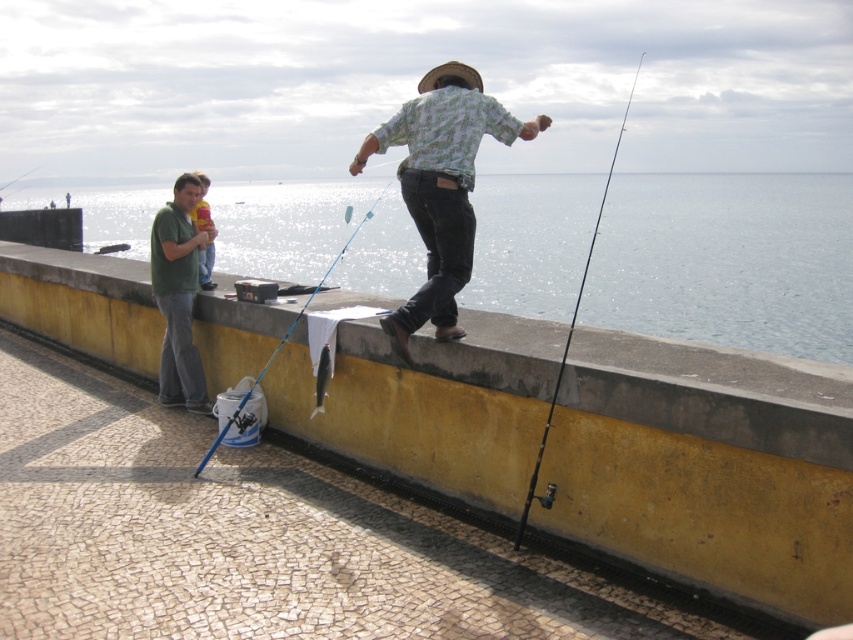
Does green cotton shirt at left have a larger size compared to blue metallic fishing pole at center?

Actually, green cotton shirt at left might be smaller than blue metallic fishing pole at center.

Does green cotton shirt at left appear over blue metallic fishing pole at center?

Actually, green cotton shirt at left is below blue metallic fishing pole at center.

Find the location of a particular element. The width and height of the screenshot is (853, 640). green cotton shirt at left is located at coordinates (178, 296).

Between point (173, 396) and point (537, 474), which one is positioned in front?

Point (537, 474) is in front.

How far apart are green cotton shirt at left and black matte fishing pole at center?

green cotton shirt at left and black matte fishing pole at center are 13.38 meters apart from each other.

Find the location of a particular element. The height and width of the screenshot is (640, 853). green cotton shirt at left is located at coordinates (178, 296).

Can you confirm if floral shirt at center is shorter than shiny silver fish at center?

No.

Is floral shirt at center smaller than shiny silver fish at center?

Incorrect, floral shirt at center is not smaller in size than shiny silver fish at center.

Find the location of `floral shirt at center`. floral shirt at center is located at coordinates (440, 186).

I want to click on floral shirt at center, so click(440, 186).